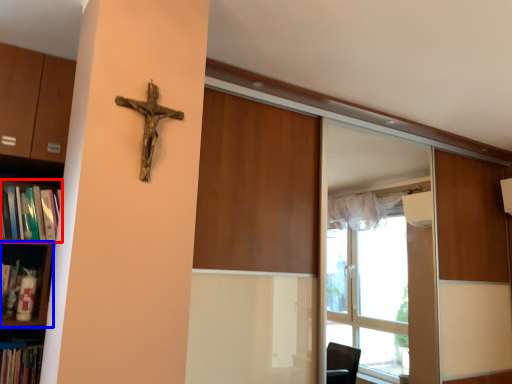
Question: Among these objects, which one is nearest to the camera, book (highlighted by a red box) or shelf (highlighted by a blue box)?

Choices:
 (A) book
 (B) shelf

Answer: (A)